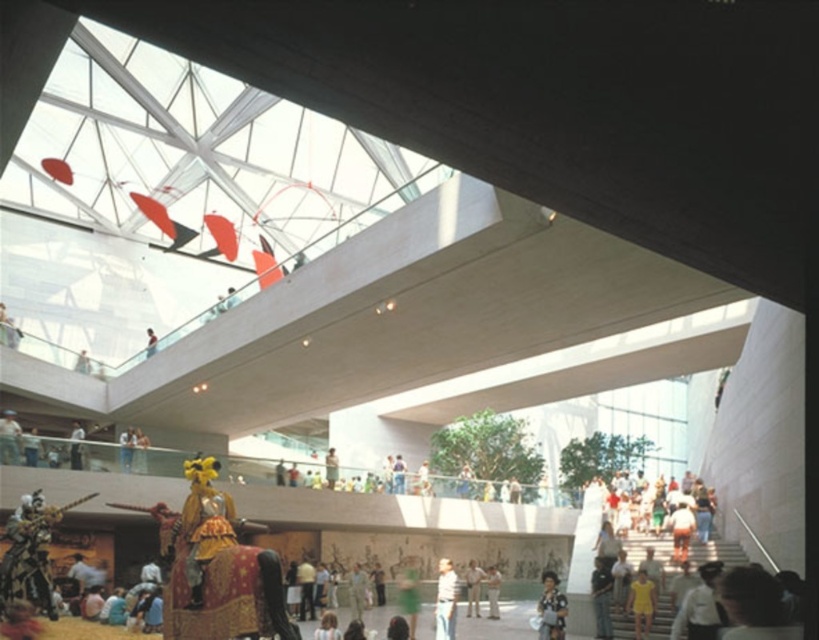
You are an event planner setting up a photo shoot in the museum. You need to place a backdrop that must be larger than both the white shirt at lower right and the yellow matte dress at lower right. Based on their sizes, which object should the backdrop be sized to accommodate?

The backdrop should be sized to accommodate the white shirt at lower right since it is larger in size than the yellow matte dress at lower right.

From the picture: You are standing at the entrance of the museum and notice two visitors wearing a white shirt at lower right and a yellow matte dress at lower right. If you want to greet both of them, which one should you approach first to minimize the total walking distance?

You should approach the white shirt at lower right first because they are closer to the entrance than the yellow matte dress at lower right, so the total walking distance will be minimized.

You are a fashion designer visiting the museum and notice two items of clothing in the exhibit. The yellow matte dress at lower right and the light brown leather jacket at center. Which clothing item is narrower in width?

The yellow matte dress at lower right is narrower in width than the light brown leather jacket at center.